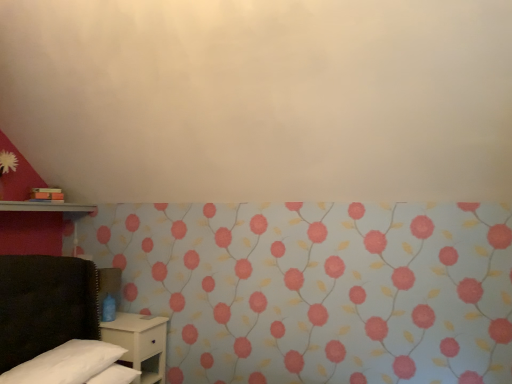
Question: From the image's perspective, is white soft pillow at lower left under metallic silver shelf at left?

Choices:
 (A) no
 (B) yes

Answer: (B)

Question: Is white soft pillow at lower left further to the viewer compared to metallic silver shelf at left?

Choices:
 (A) no
 (B) yes

Answer: (A)

Question: Are white soft pillow at lower left and metallic silver shelf at left beside each other?

Choices:
 (A) yes
 (B) no

Answer: (B)

Question: From the image's perspective, is white soft pillow at lower left located above metallic silver shelf at left?

Choices:
 (A) no
 (B) yes

Answer: (A)

Question: From a real-world perspective, does white soft pillow at lower left stand above metallic silver shelf at left?

Choices:
 (A) yes
 (B) no

Answer: (B)

Question: Would you say floral wallpaper at lower left is to the left or to the right of metallic silver shelf at left in the picture?

Choices:
 (A) right
 (B) left

Answer: (A)

Question: Is point (454, 266) positioned closer to the camera than point (12, 208)?

Choices:
 (A) closer
 (B) farther

Answer: (A)

Question: Which is correct: floral wallpaper at lower left is inside metallic silver shelf at left, or outside of it?

Choices:
 (A) outside
 (B) inside

Answer: (A)

Question: In terms of size, does floral wallpaper at lower left appear bigger or smaller than metallic silver shelf at left?

Choices:
 (A) small
 (B) big

Answer: (B)

Question: Is white matte nightstand at lower left to the left or to the right of metallic silver shelf at left in the image?

Choices:
 (A) right
 (B) left

Answer: (A)

Question: From the image's perspective, is white matte nightstand at lower left above or below metallic silver shelf at left?

Choices:
 (A) below
 (B) above

Answer: (A)

Question: Considering their positions, is white matte nightstand at lower left located in front of or behind metallic silver shelf at left?

Choices:
 (A) behind
 (B) front

Answer: (A)

Question: Does point (163, 362) appear closer or farther from the camera than point (88, 203)?

Choices:
 (A) closer
 (B) farther

Answer: (A)

Question: Considering the positions of point (132, 349) and point (78, 365), is point (132, 349) closer or farther from the camera than point (78, 365)?

Choices:
 (A) farther
 (B) closer

Answer: (A)

Question: In the image, is white matte nightstand at lower left positioned in front of or behind white soft pillow at lower left?

Choices:
 (A) front
 (B) behind

Answer: (B)